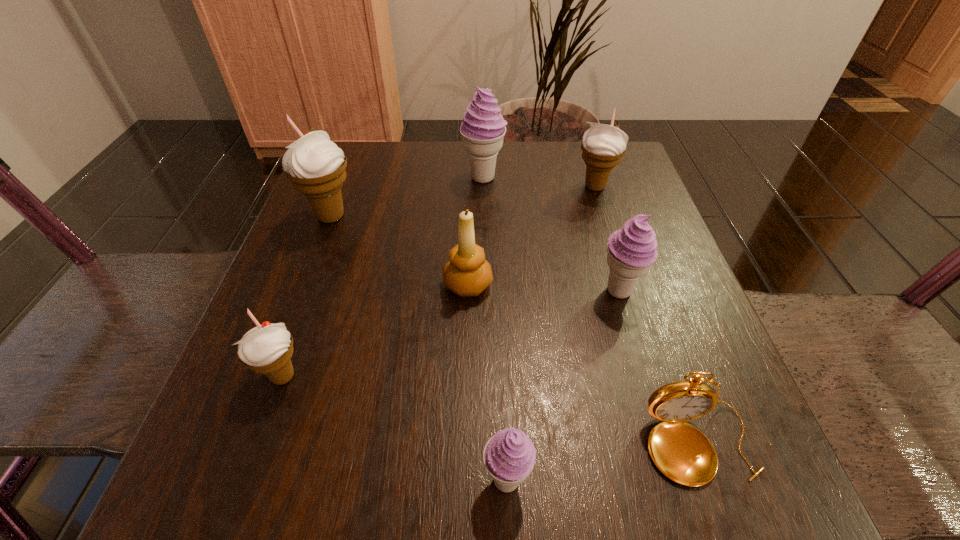
Where is `the farthest purple icecream`? The image size is (960, 540). the farthest purple icecream is located at coordinates (483, 128).

Locate an element on the screen. the biggest white icecream is located at coordinates (315, 165).

At what (x,y) coordinates should I click in order to perform the action: click on the third farthest object. Please return your answer as a coordinate pair (x, y). Looking at the image, I should click on (315, 165).

Identify the location of the rightmost white icecream. This screenshot has height=540, width=960. (603, 145).

At what (x,y) coordinates should I click in order to perform the action: click on the second smallest white icecream. Please return your answer as a coordinate pair (x, y). This screenshot has height=540, width=960. Looking at the image, I should click on (603, 145).

I want to click on the fourth farthest icecream, so click(631, 250).

Identify the location of the rightmost purple icecream. (631, 250).

Locate an element on the screen. The height and width of the screenshot is (540, 960). candle_holder is located at coordinates (467, 274).

I want to click on the third nearest object, so click(x=267, y=349).

Find the location of `the nearest white icecream`. the nearest white icecream is located at coordinates (267, 349).